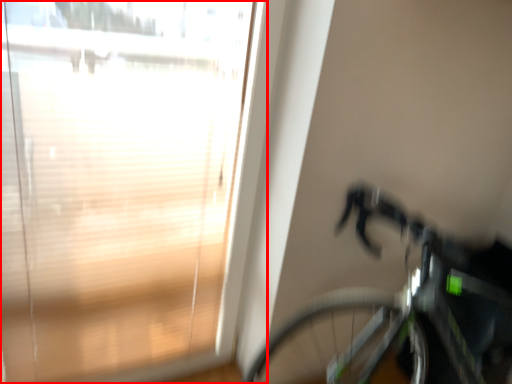
Question: Considering the relative positions of window (annotated by the red box) and bicycle in the image provided, where is window (annotated by the red box) located with respect to the staircase?

Choices:
 (A) right
 (B) left

Answer: (B)